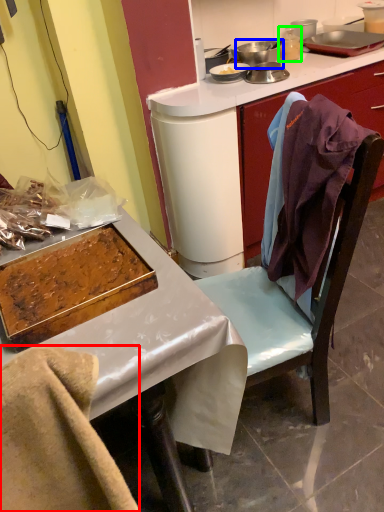
Question: Estimate the real-world distances between objects in this image. Which object is closer to leftover (highlighted by a red box), appliance (highlighted by a blue box) or appliance (highlighted by a green box)?

Choices:
 (A) appliance
 (B) appliance

Answer: (A)